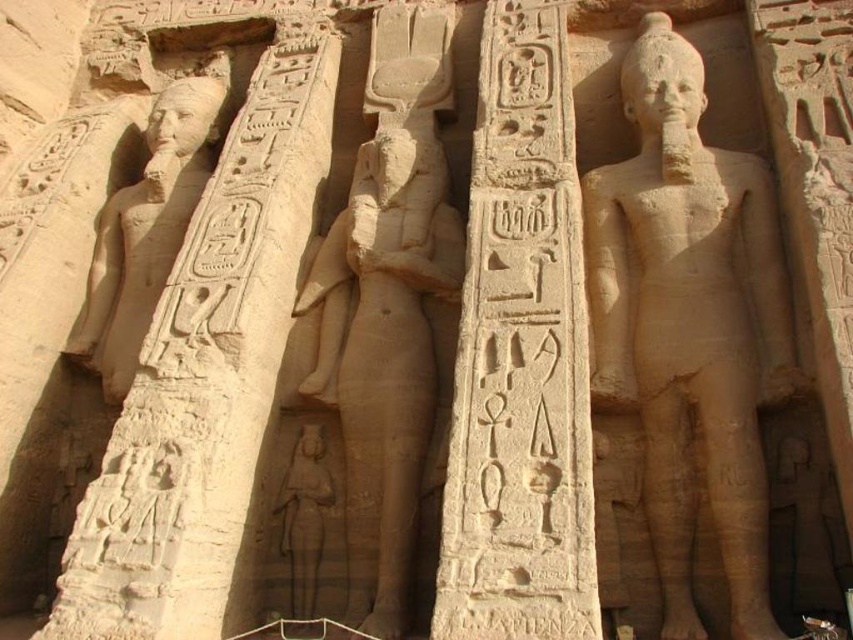
Question: Can you confirm if sandstone statue at center is positioned to the right of smooth sandstone statue at center?

Choices:
 (A) yes
 (B) no

Answer: (A)

Question: Is the position of smooth stone column at center more distant than that of sandstone statue at left?

Choices:
 (A) no
 (B) yes

Answer: (A)

Question: Which point appears farthest from the camera in this image?

Choices:
 (A) (442, 179)
 (B) (670, 627)
 (C) (490, 216)

Answer: (A)

Question: Among these objects, which one is farthest from the camera?

Choices:
 (A) smooth stone column at center
 (B) sandstone statue at center
 (C) smooth sandstone statue at center

Answer: (C)

Question: Is sandstone statue at center to the right of smooth stone column at center from the viewer's perspective?

Choices:
 (A) yes
 (B) no

Answer: (A)

Question: Among these objects, which one is farthest from the camera?

Choices:
 (A) sandstone statue at center
 (B) smooth stone column at center
 (C) sandstone statue at left

Answer: (C)